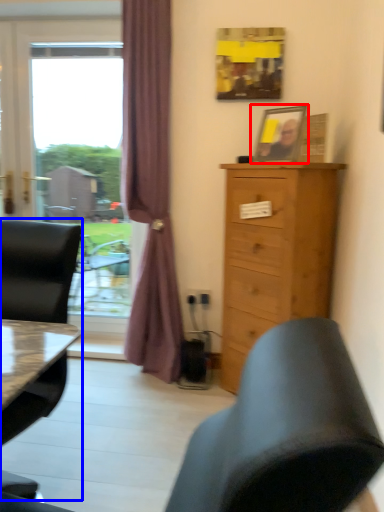
Question: Which point is further to the camera, picture frame (highlighted by a red box) or chair (highlighted by a blue box)?

Choices:
 (A) picture frame
 (B) chair

Answer: (A)